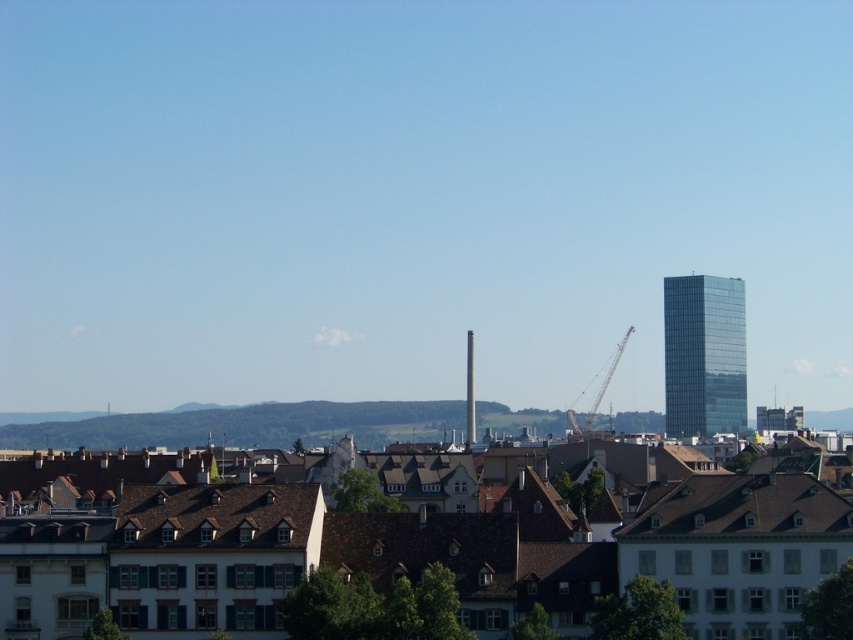
Question: Is green glass tower at right wider than metallic gray crane at center?

Choices:
 (A) no
 (B) yes

Answer: (A)

Question: Is green glass tower at right wider than metallic gray crane at center?

Choices:
 (A) no
 (B) yes

Answer: (A)

Question: Is green glass tower at right positioned in front of metallic gray crane at center?

Choices:
 (A) yes
 (B) no

Answer: (B)

Question: Which point is farther from the camera taking this photo?

Choices:
 (A) (693, 408)
 (B) (606, 387)

Answer: (B)

Question: Which point is closer to the camera?

Choices:
 (A) metallic gray crane at center
 (B) green glass tower at right

Answer: (A)